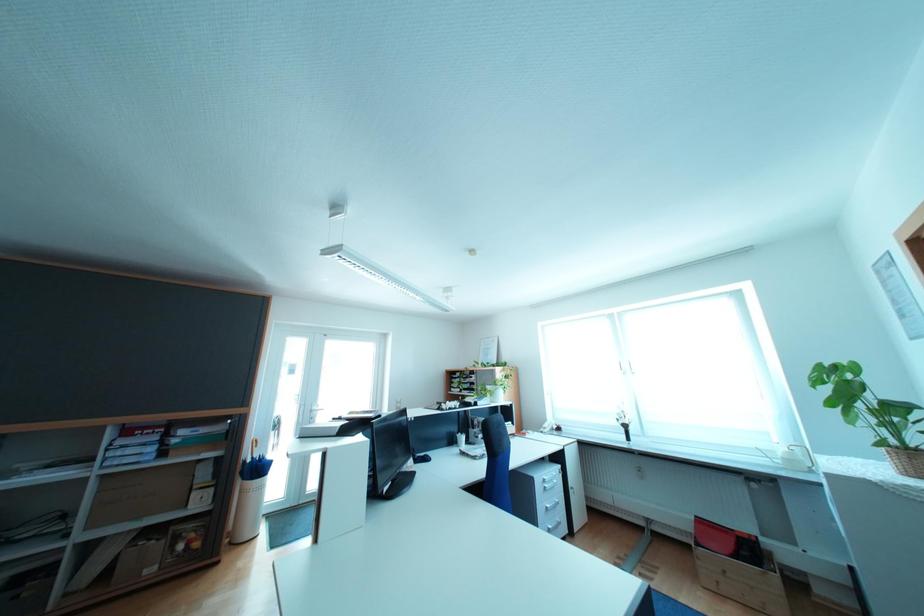
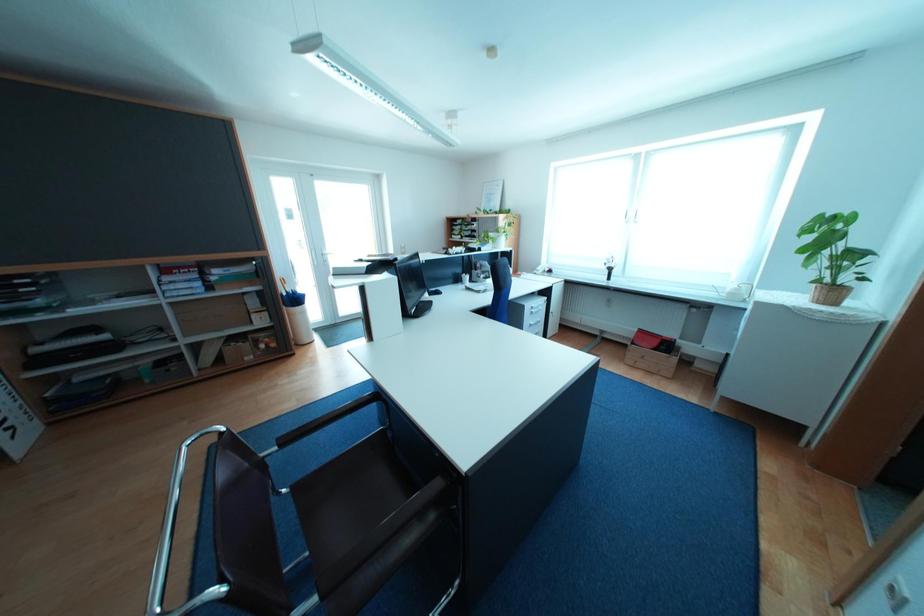
Question: Based on the continuous images, in which direction is the camera rotating? Reply with the corresponding letter.

Choices:
 (A) Left
 (B) Right
 (C) Up
 (D) Down

Answer: (D)